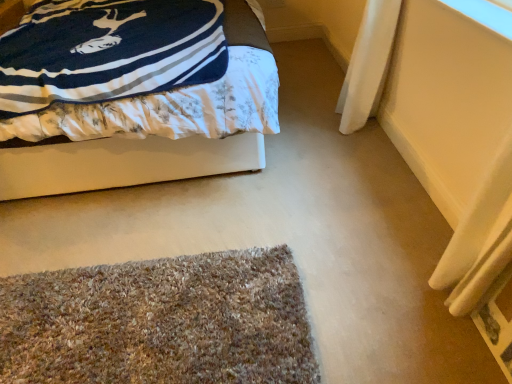
Question: Considering the positions of multicolored shaggy mat at lower center and transparent plastic window screen at upper right in the image, is multicolored shaggy mat at lower center bigger or smaller than transparent plastic window screen at upper right?

Choices:
 (A) small
 (B) big

Answer: (B)

Question: Is point (161, 264) closer or farther from the camera than point (486, 18)?

Choices:
 (A) farther
 (B) closer

Answer: (A)

Question: Which of these objects is positioned closest to the velvet-like blue blanket at upper left?

Choices:
 (A) multicolored shaggy mat at lower center
 (B) transparent plastic window screen at upper right

Answer: (A)

Question: Estimate the real-world distances between objects in this image. Which object is closer to the transparent plastic window screen at upper right?

Choices:
 (A) multicolored shaggy mat at lower center
 (B) velvet-like blue blanket at upper left

Answer: (B)